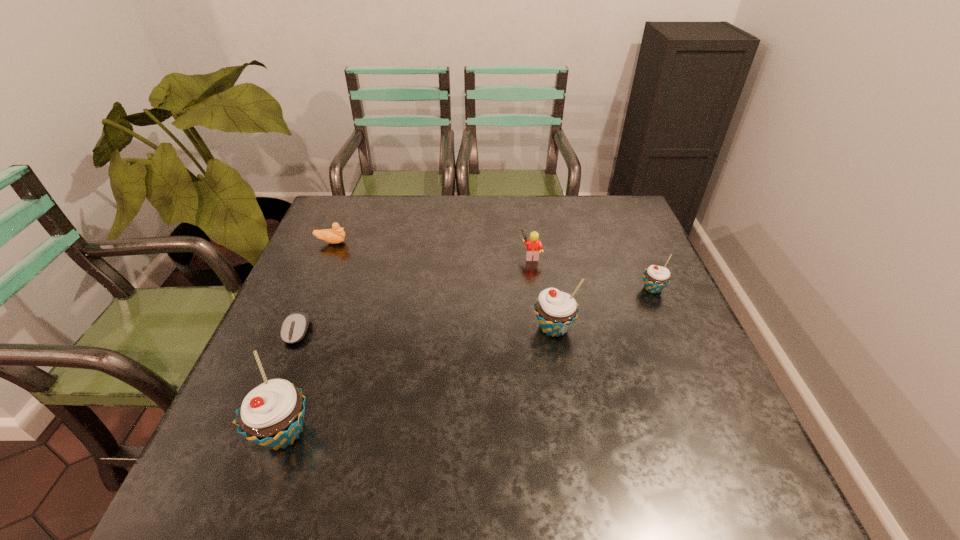
The width and height of the screenshot is (960, 540). I want to click on the leftmost cupcake, so click(x=271, y=415).

In order to click on the nearest cupcake in this screenshot , I will do `click(271, 415)`.

Locate an element on the screen. This screenshot has width=960, height=540. the second shortest cupcake is located at coordinates (556, 311).

Identify the location of the second tallest object. (556, 311).

What are the coordinates of `the rightmost object` in the screenshot? It's located at (656, 278).

I want to click on the farthest cupcake, so click(656, 278).

You are a GUI agent. You are given a task and a screenshot of the screen. Output one action in this format:
    pyautogui.click(x=<x>, y=<y>)
    Task: Click on the farthest object
    
    Given the screenshot: What is the action you would take?
    pyautogui.click(x=336, y=235)

Find the location of a particular element. duckling is located at coordinates (336, 235).

You are a GUI agent. You are given a task and a screenshot of the screen. Output one action in this format:
    pyautogui.click(x=<x>, y=<y>)
    Task: Click on the fifth nearest object
    This screenshot has width=960, height=540.
    Given the screenshot: What is the action you would take?
    pyautogui.click(x=534, y=246)

Where is `the shortest object`? The width and height of the screenshot is (960, 540). the shortest object is located at coordinates (294, 327).